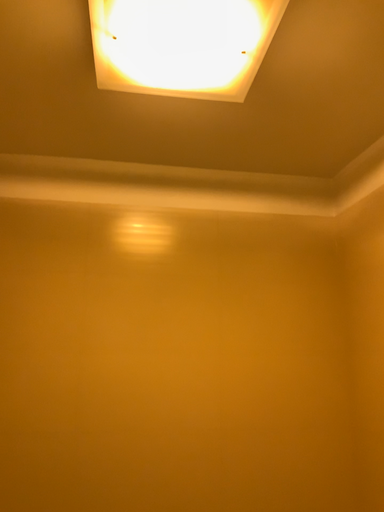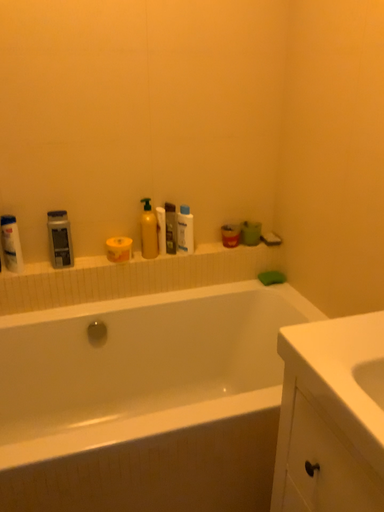
Question: Which way did the camera rotate in the video?

Choices:
 (A) rotated right
 (B) rotated left

Answer: (A)